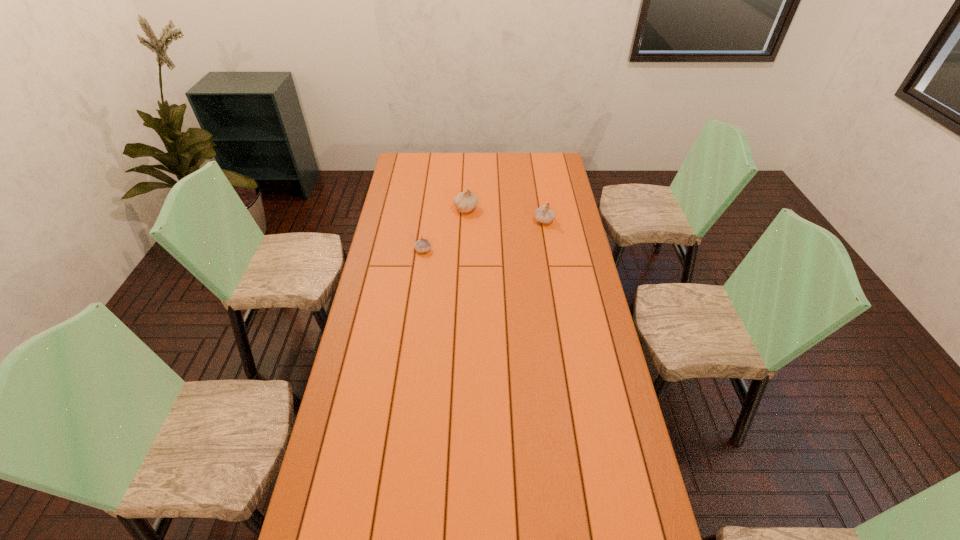
Identify the location of the rightmost object. (543, 214).

The width and height of the screenshot is (960, 540). Identify the location of the second object from left to right. (466, 201).

Image resolution: width=960 pixels, height=540 pixels. Identify the location of the shortest object. (422, 245).

Image resolution: width=960 pixels, height=540 pixels. What are the coordinates of `the shortest garlic` in the screenshot? It's located at (422, 245).

Find the location of a particular element. vacant space located 0.310m on the front of the rightmost object is located at coordinates (553, 273).

Identify the location of free space located on the left of the second garlic from right to left. (404, 208).

I want to click on vacant space located on the front of the leftmost garlic, so click(421, 265).

Locate an element on the screen. object present at the right edge is located at coordinates (543, 214).

Identify the location of free space at the far edge. The height and width of the screenshot is (540, 960). (468, 152).

Where is `vacant space at the left edge of the desktop`? This screenshot has width=960, height=540. vacant space at the left edge of the desktop is located at coordinates (359, 418).